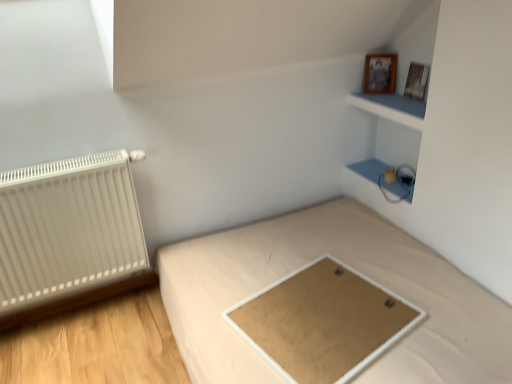
Question: Is wooden picture frame at upper right, which is the 1th picture frame from right to left, wider than light brown fabric bed at center?

Choices:
 (A) no
 (B) yes

Answer: (A)

Question: Does wooden picture frame at upper right, placed as the 2th picture frame when sorted from left to right, have a smaller size compared to light brown fabric bed at center?

Choices:
 (A) no
 (B) yes

Answer: (B)

Question: From the image's perspective, does wooden picture frame at upper right, which is the 1th picture frame from right to left, appear lower than light brown fabric bed at center?

Choices:
 (A) no
 (B) yes

Answer: (A)

Question: Can you confirm if wooden picture frame at upper right, which is the 1th picture frame from right to left, is positioned to the right of light brown fabric bed at center?

Choices:
 (A) yes
 (B) no

Answer: (A)

Question: Can you confirm if wooden picture frame at upper right, placed as the 2th picture frame when sorted from left to right, is positioned to the left of light brown fabric bed at center?

Choices:
 (A) no
 (B) yes

Answer: (A)

Question: Considering the relative sizes of wooden picture frame at upper right, which is the 1th picture frame from right to left, and light brown fabric bed at center in the image provided, is wooden picture frame at upper right, which is the 1th picture frame from right to left, shorter than light brown fabric bed at center?

Choices:
 (A) yes
 (B) no

Answer: (A)

Question: Is wooden photo frame at upper right, marked as the 1th picture frame in a left-to-right arrangement, outside of blue matte cabinet at upper right, which is counted as the first cabinet, starting from the top?

Choices:
 (A) no
 (B) yes

Answer: (B)

Question: Considering the relative positions of wooden photo frame at upper right, marked as the 1th picture frame in a left-to-right arrangement, and blue matte cabinet at upper right, which is counted as the 2th cabinet, starting from the bottom, in the image provided, is wooden photo frame at upper right, marked as the 1th picture frame in a left-to-right arrangement, to the left of blue matte cabinet at upper right, which is counted as the 2th cabinet, starting from the bottom, from the viewer's perspective?

Choices:
 (A) yes
 (B) no

Answer: (A)

Question: From the image's perspective, is wooden photo frame at upper right, marked as the 2th picture frame in a right-to-left arrangement, on top of blue matte cabinet at upper right, which is counted as the 2th cabinet, starting from the bottom?

Choices:
 (A) no
 (B) yes

Answer: (B)

Question: Would you consider wooden photo frame at upper right, marked as the 2th picture frame in a right-to-left arrangement, to be distant from blue matte cabinet at upper right, which is counted as the 2th cabinet, starting from the bottom?

Choices:
 (A) no
 (B) yes

Answer: (A)

Question: Does wooden photo frame at upper right, marked as the 2th picture frame in a right-to-left arrangement, have a greater height compared to blue matte cabinet at upper right, which is counted as the first cabinet, starting from the top?

Choices:
 (A) no
 (B) yes

Answer: (B)

Question: Are wooden photo frame at upper right, marked as the 2th picture frame in a right-to-left arrangement, and blue matte cabinet at upper right, which is counted as the 2th cabinet, starting from the bottom, making contact?

Choices:
 (A) no
 (B) yes

Answer: (A)

Question: Is wooden picture frame at upper right, which is the 1th picture frame from right to left, closer to the viewer compared to matte white cabinet at upper right, the second cabinet in the top-to-bottom sequence?

Choices:
 (A) no
 (B) yes

Answer: (B)